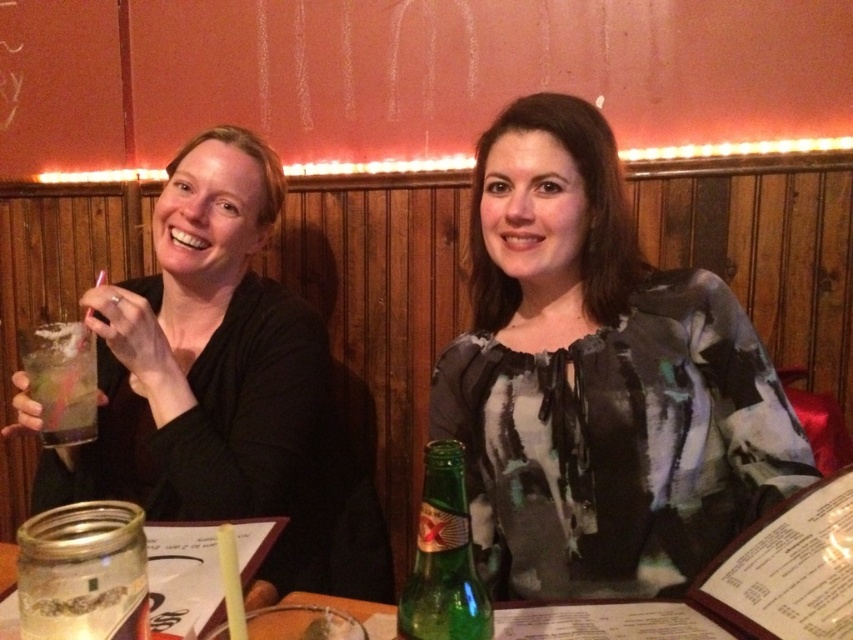
Question: Considering the relative positions of printed silk blouse at center and green glass bottle at center in the image provided, where is printed silk blouse at center located with respect to green glass bottle at center?

Choices:
 (A) below
 (B) above

Answer: (B)

Question: Which of the following is the closest to the observer?

Choices:
 (A) (433, 372)
 (B) (322, 499)
 (C) (430, 506)
 (D) (55, 372)

Answer: (C)

Question: Can you confirm if printed silk blouse at center is positioned below green glass bottle at center?

Choices:
 (A) yes
 (B) no

Answer: (B)

Question: Can you confirm if green glass bottle at center is positioned to the right of clear plastic cup at left?

Choices:
 (A) no
 (B) yes

Answer: (B)

Question: Which object appears farthest from the camera in this image?

Choices:
 (A) clear plastic cup at left
 (B) matte black shirt at left

Answer: (B)

Question: Based on their relative distances, which object is farther from the printed silk blouse at center?

Choices:
 (A) green glass bottle at center
 (B) matte black shirt at left

Answer: (A)